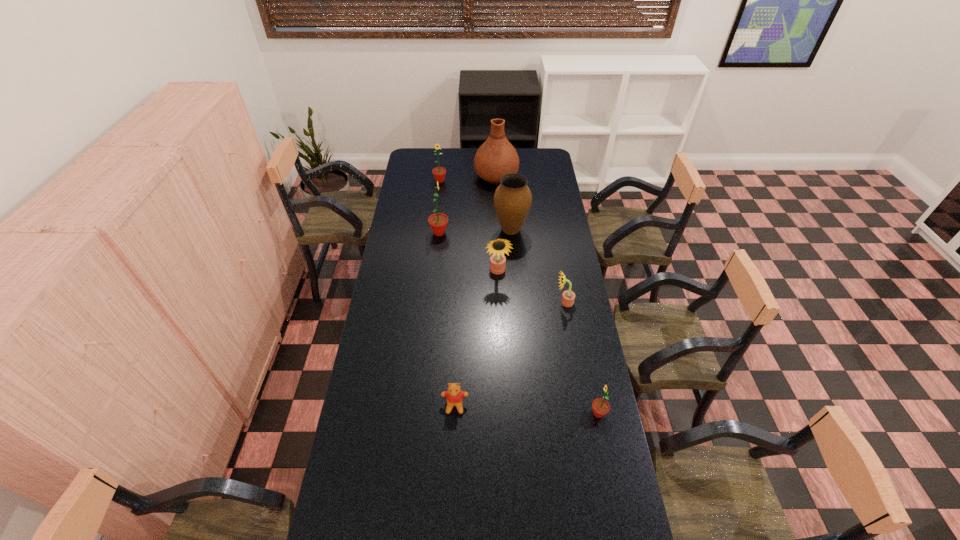
In the image, there is a desktop. Where is `vacant space at the left edge`? vacant space at the left edge is located at coordinates (407, 190).

You are a GUI agent. You are given a task and a screenshot of the screen. Output one action in this format:
    pyautogui.click(x=<x>, y=<y>)
    Task: Click on the free region at the right edge
    
    Given the screenshot: What is the action you would take?
    (540, 180)

This screenshot has width=960, height=540. What are the coordinates of `vacant area that lies between the urn and the shortest object` in the screenshot? It's located at (483, 318).

I want to click on free space between the third nearest object and the urn, so click(x=538, y=266).

You are a GUI agent. You are given a task and a screenshot of the screen. Output one action in this format:
    pyautogui.click(x=<x>, y=<y>)
    Task: Click on the free spot between the third object from left to right and the pitcher
    
    Given the screenshot: What is the action you would take?
    pyautogui.click(x=475, y=290)

You are a GUI agent. You are given a task and a screenshot of the screen. Output one action in this format:
    pyautogui.click(x=<x>, y=<y>)
    Task: Click on the vacant point located between the left yellow sunflower and the nearer yellow sunflower
    
    Given the screenshot: What is the action you would take?
    pyautogui.click(x=531, y=287)

Where is `unoccupied area between the third nearest sunflower and the nearer yellow sunflower`? unoccupied area between the third nearest sunflower and the nearer yellow sunflower is located at coordinates (531, 287).

Point out which object is positioned as the second nearest to the smallest green sunflower. Please provide its 2D coordinates. Your answer should be formatted as a tuple, i.e. [(x, y)], where the tuple contains the x and y coordinates of a point satisfying the conditions above.

[(568, 297)]

Locate an element on the screen. Image resolution: width=960 pixels, height=540 pixels. object that is the closest to the second farthest green sunflower is located at coordinates (512, 199).

Locate an element on the screen. the closest sunflower to the pitcher is located at coordinates [439, 173].